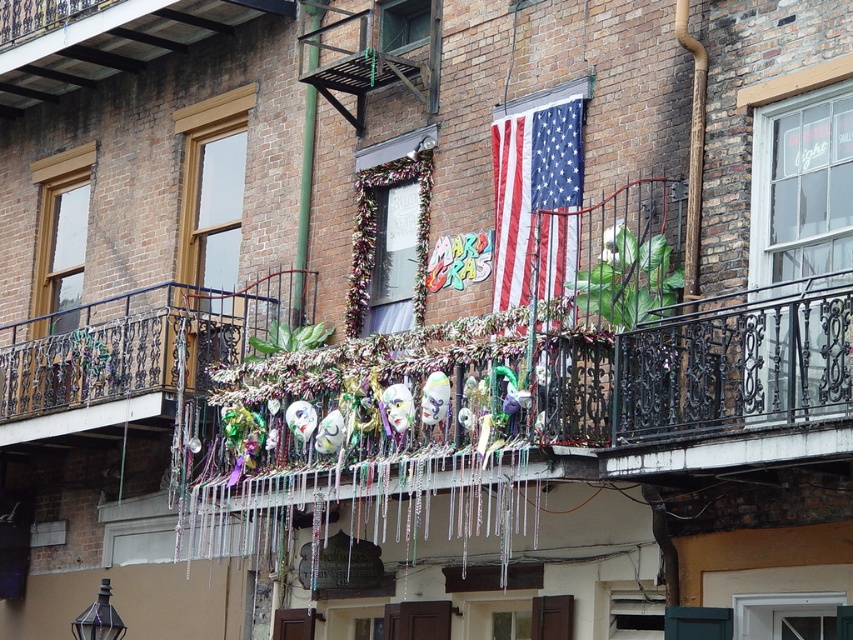
Question: Based on their relative distances, which object is farther from the american flag at center?

Choices:
 (A) green metal pole at center
 (B) metallic wrought iron balcony at center
 (C) metallic black balcony at upper center

Answer: (B)

Question: From the image, what is the correct spatial relationship of metallic wrought iron balcony at center in relation to metallic black balcony at upper center?

Choices:
 (A) right
 (B) left

Answer: (B)

Question: In this image, where is metallic wrought iron balcony at center located relative to american flag at center?

Choices:
 (A) above
 (B) below

Answer: (B)

Question: Which of the following is the closest to the observer?

Choices:
 (A) (30, 419)
 (B) (434, 84)
 (C) (494, 140)
 (D) (302, 16)

Answer: (C)

Question: Does american flag at center have a smaller size compared to green metal pole at center?

Choices:
 (A) no
 (B) yes

Answer: (A)

Question: Which object is positioned farthest from the american flag at center?

Choices:
 (A) green metal pole at center
 (B) metallic black balcony at upper center

Answer: (A)